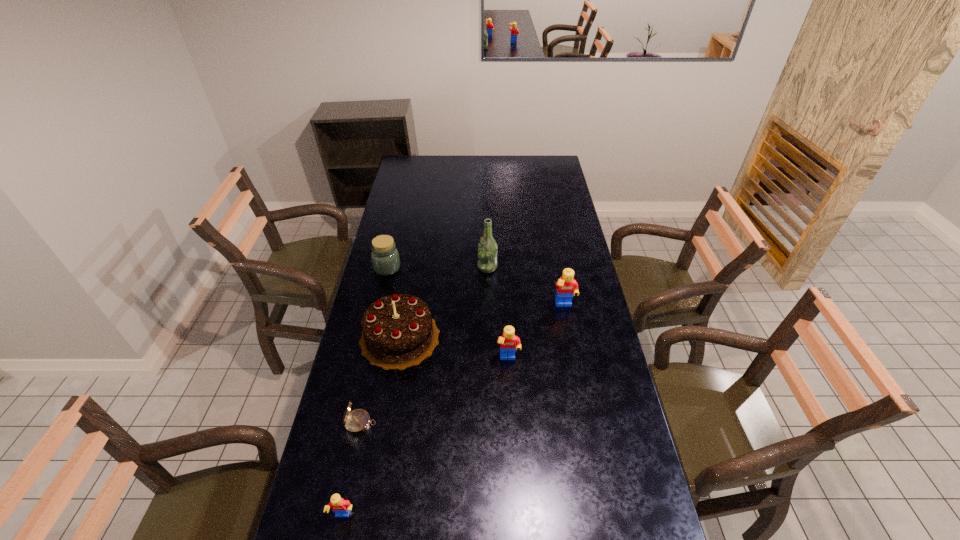
Identify the location of the nearest object. Image resolution: width=960 pixels, height=540 pixels. (341, 507).

The height and width of the screenshot is (540, 960). Identify the location of the leftmost Lego. (341, 507).

Locate an element on the screen. the second Lego from right to left is located at coordinates (509, 343).

This screenshot has height=540, width=960. In order to click on the second tallest Lego in this screenshot , I will do `click(509, 343)`.

You are a GUI agent. You are given a task and a screenshot of the screen. Output one action in this format:
    pyautogui.click(x=<x>, y=<y>)
    Task: Click on the farthest Lego
    
    Given the screenshot: What is the action you would take?
    pyautogui.click(x=566, y=286)

This screenshot has width=960, height=540. I want to click on the rightmost Lego, so (566, 286).

Where is `the tallest object`? the tallest object is located at coordinates (487, 248).

The height and width of the screenshot is (540, 960). Identify the location of jar. (385, 258).

I want to click on birthday cake, so click(x=398, y=331).

The image size is (960, 540). I want to click on the second nearest object, so click(x=356, y=422).